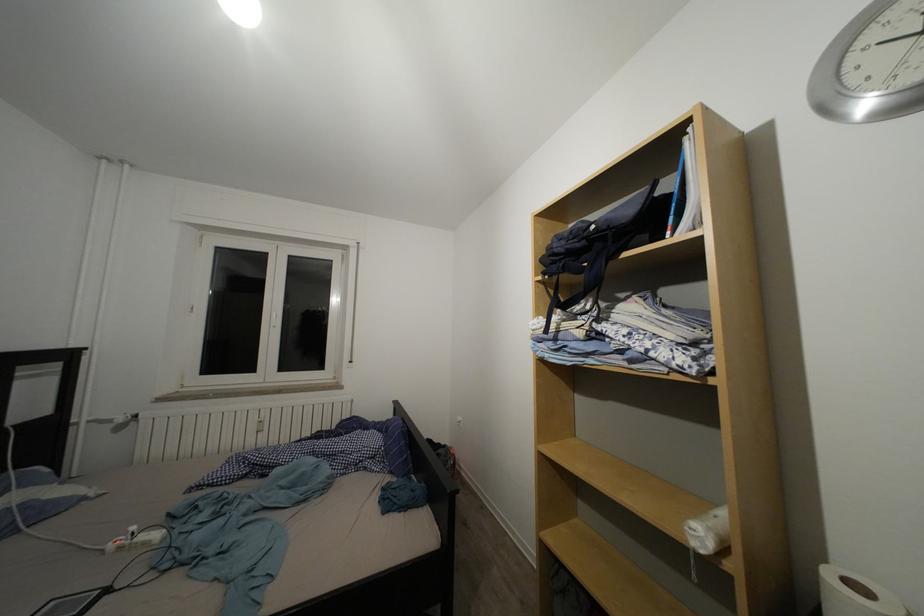
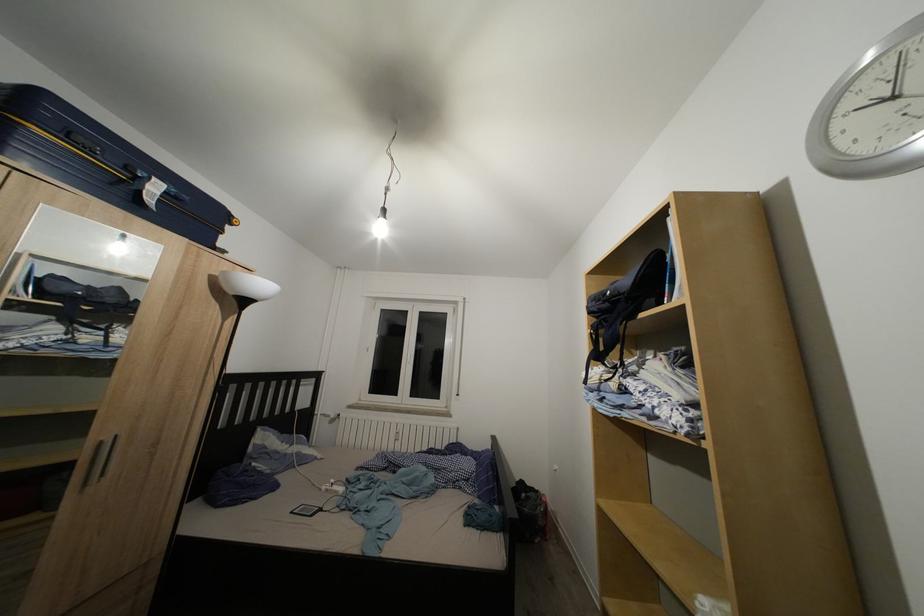
Question: The first image is from the beginning of the video and the second image is from the end. How did the camera likely rotate when shooting the video?

Choices:
 (A) Left
 (B) Right
 (C) Up
 (D) Down

Answer: (A)